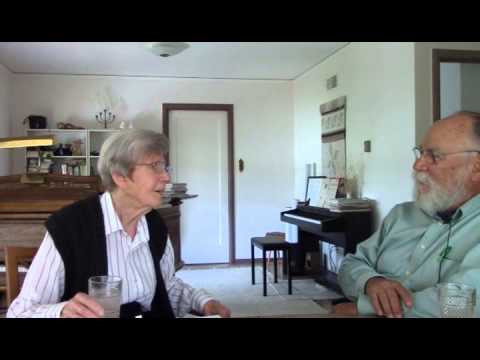
This screenshot has height=360, width=480. I want to click on bench, so click(273, 241).